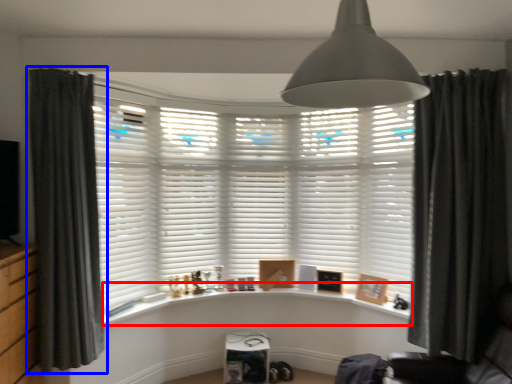
Question: Which object appears farthest to the camera in this image, window sill (highlighted by a red box) or curtain (highlighted by a blue box)?

Choices:
 (A) window sill
 (B) curtain

Answer: (A)